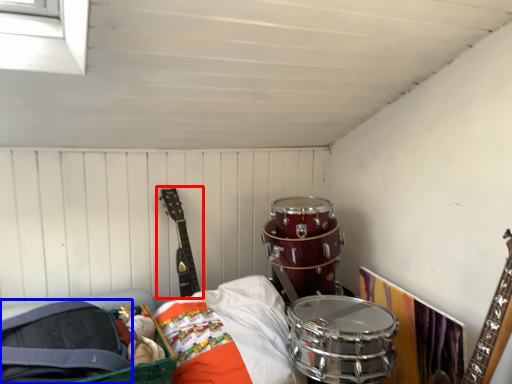
Question: Among these objects, which one is nearest to the camera, guitar (highlighted by a red box) or drum (highlighted by a blue box)?

Choices:
 (A) guitar
 (B) drum

Answer: (B)